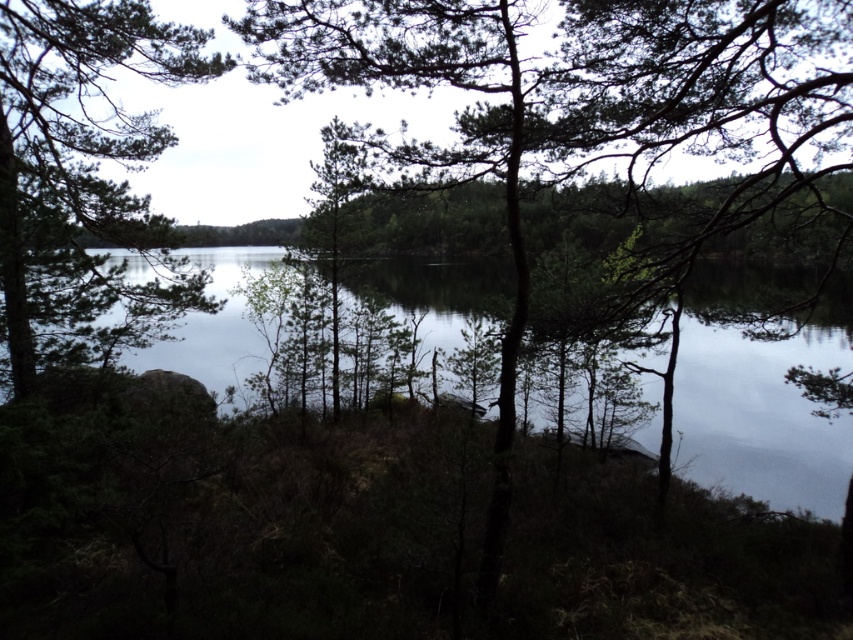
Is the position of green matte tree at left more distant than that of transparent water at center?

Yes, green matte tree at left is behind transparent water at center.

Who is positioned more to the right, green matte tree at left or transparent water at center?

transparent water at center is more to the right.

Is point (161, 280) positioned in front of point (407, 259)?

Yes, it is.

The image size is (853, 640). I want to click on green matte tree at left, so click(x=85, y=180).